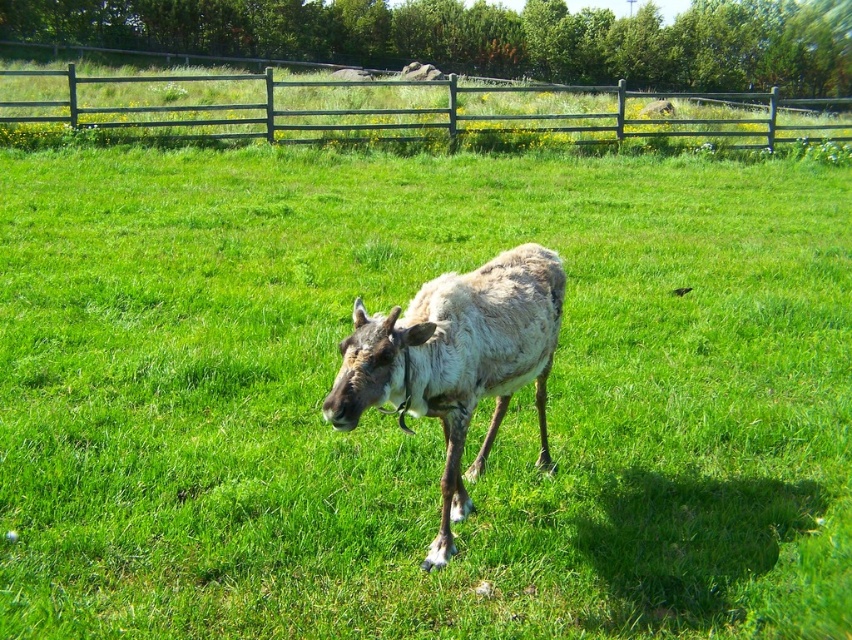
Which is more to the right, wooden fence at upper center or fuzzy brown reindeer at center?

From the viewer's perspective, wooden fence at upper center appears more on the right side.

Does point (273, 90) lie behind point (426, 349)?

Yes, point (273, 90) is behind point (426, 349).

Find the location of a particular element. This screenshot has height=640, width=852. wooden fence at upper center is located at coordinates (404, 108).